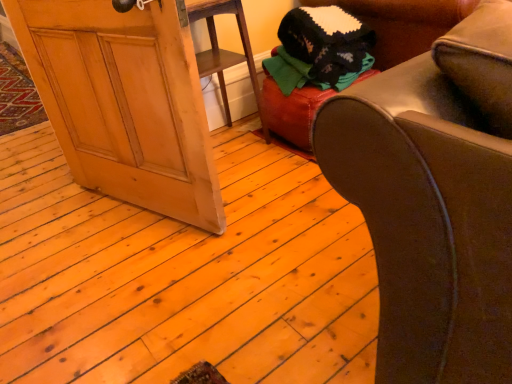
Question: Considering the relative sizes of knitted wool sweater at upper right and wooden screen door at lower left in the image provided, is knitted wool sweater at upper right thinner than wooden screen door at lower left?

Choices:
 (A) yes
 (B) no

Answer: (B)

Question: Does knitted wool sweater at upper right turn towards wooden screen door at lower left?

Choices:
 (A) no
 (B) yes

Answer: (A)

Question: Does knitted wool sweater at upper right appear on the left side of wooden screen door at lower left?

Choices:
 (A) no
 (B) yes

Answer: (A)

Question: Can you confirm if knitted wool sweater at upper right is taller than wooden screen door at lower left?

Choices:
 (A) yes
 (B) no

Answer: (B)

Question: Is knitted wool sweater at upper right looking in the opposite direction of wooden screen door at lower left?

Choices:
 (A) yes
 (B) no

Answer: (B)

Question: Does knitted wool sweater at upper right contain wooden screen door at lower left?

Choices:
 (A) yes
 (B) no

Answer: (B)

Question: Does wooden screen door at lower left have a lesser width compared to knitted wool sweater at upper right?

Choices:
 (A) no
 (B) yes

Answer: (B)

Question: Would you say wooden screen door at lower left contains knitted wool sweater at upper right?

Choices:
 (A) no
 (B) yes

Answer: (A)

Question: Is wooden screen door at lower left facing towards knitted wool sweater at upper right?

Choices:
 (A) yes
 (B) no

Answer: (B)

Question: Does wooden screen door at lower left have a greater height compared to knitted wool sweater at upper right?

Choices:
 (A) no
 (B) yes

Answer: (B)

Question: From a real-world perspective, is wooden screen door at lower left physically below knitted wool sweater at upper right?

Choices:
 (A) no
 (B) yes

Answer: (A)

Question: Is wooden screen door at lower left smaller than knitted wool sweater at upper right?

Choices:
 (A) yes
 (B) no

Answer: (B)

Question: From the image's perspective, would you say leather ottoman at center is positioned over wooden screen door at lower left?

Choices:
 (A) yes
 (B) no

Answer: (A)